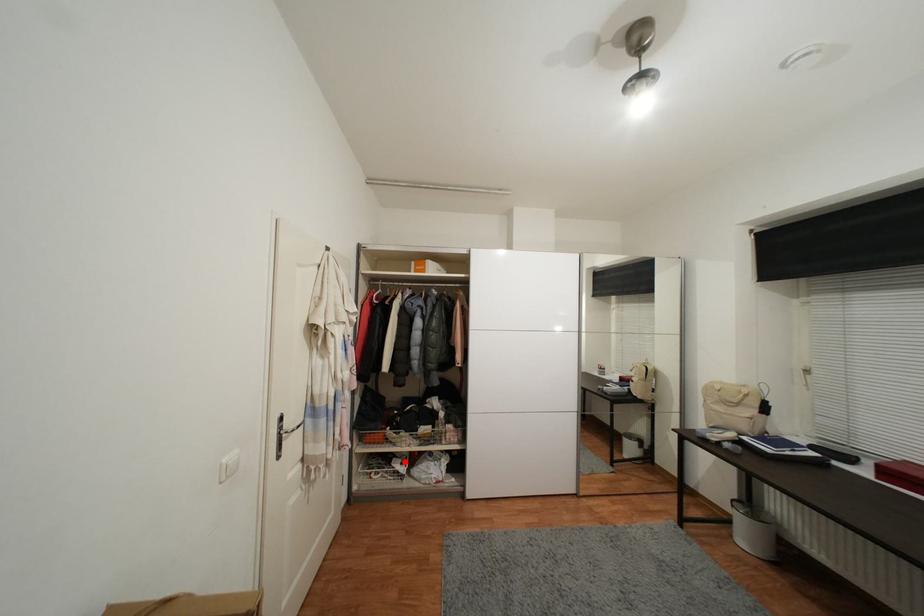
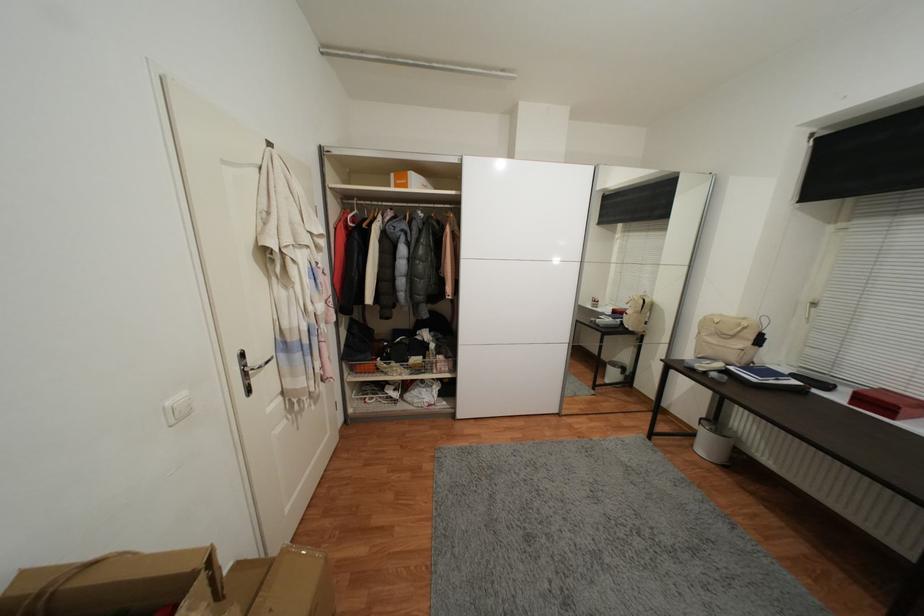
Question: I am providing you with two images of the same scene from different viewpoints. A red point is shown in image1. For the corresponding object point in image2, is it positioned nearer or farther from the camera?

Choices:
 (A) Nearer
 (B) Farther

Answer: (A)